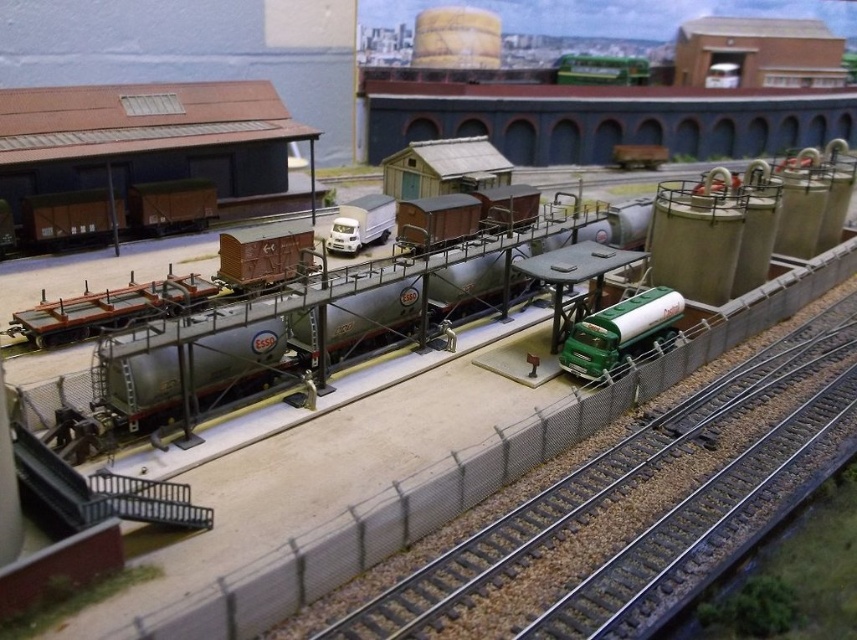
You are a model train enthusiast who wants to place a new locomotive between the metallic gray train track at center and the metallic silver tank car at center. The locomotive is 10 feet long. Is there enough space between them to fit the locomotive?

The metallic gray train track at center is 16.58 feet from the metallic silver tank car at center. Since the locomotive is 10 feet long, there is sufficient space to place it between them as 16.58 feet is greater than 10 feet.

You are a model railway enthusiast inspecting the layout. You notice the metallic gray train track at center and the metallic silver tank car at center. Which object is positioned lower in the scene?

The metallic gray train track at center is located below the metallic silver tank car at center, so it is positioned lower in the scene.